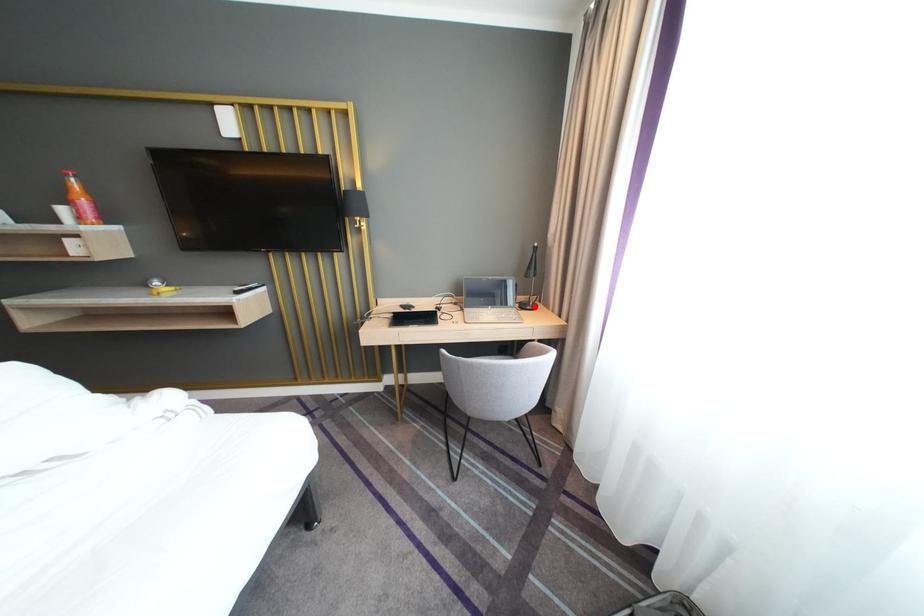
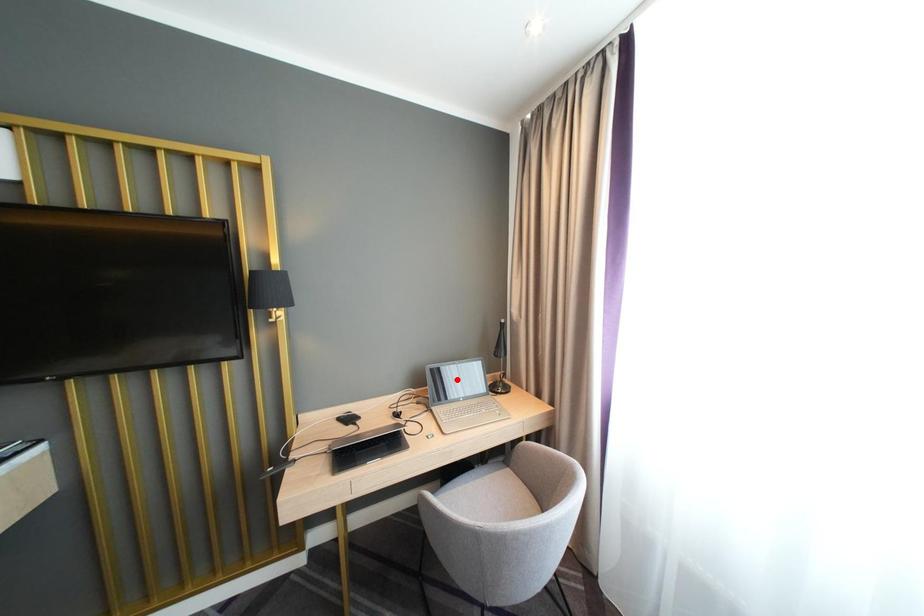
I am providing you with two images of the same scene from different viewpoints. A red point is marked on the first image and another point is marked on the second image. Are the points marked in image1 and image2 representing the same 3D position?

No